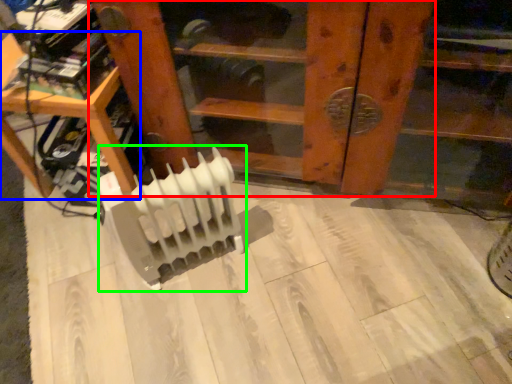
Question: Which object is the closest to the furniture (highlighted by a red box)? Choose among these: furniture (highlighted by a blue box) or radiator (highlighted by a green box).

Choices:
 (A) furniture
 (B) radiator

Answer: (B)